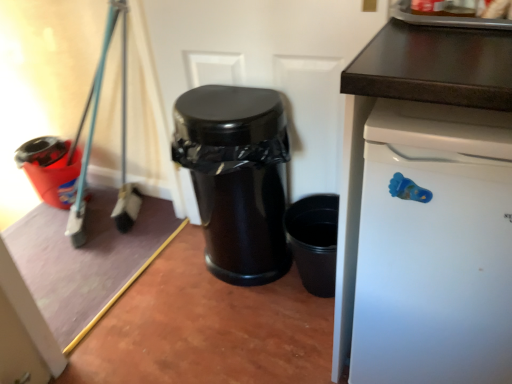
Question: From a real-world perspective, is glossy black trash can at center, which is the 1th waste container in front-to-back order, physically below white matte dishwasher at right?

Choices:
 (A) yes
 (B) no

Answer: (A)

Question: From the image's perspective, is glossy black trash can at center, which is the second waste container in back-to-front order, on white matte dishwasher at right?

Choices:
 (A) no
 (B) yes

Answer: (B)

Question: Is glossy black trash can at center, which is the 1th waste container in front-to-back order, facing towards white matte dishwasher at right?

Choices:
 (A) yes
 (B) no

Answer: (B)

Question: Is glossy black trash can at center, positioned as the first waste container in right-to-left order, to the right of white matte dishwasher at right from the viewer's perspective?

Choices:
 (A) no
 (B) yes

Answer: (A)

Question: Is white matte dishwasher at right a part of glossy black trash can at center, which is the 1th waste container in front-to-back order?

Choices:
 (A) no
 (B) yes

Answer: (A)

Question: Based on their sizes in the image, would you say white matte dishwasher at right is bigger or smaller than matte plastic bucket at left, placed as the 2th waste container when sorted from front to back?

Choices:
 (A) big
 (B) small

Answer: (A)

Question: From the image's perspective, is white matte dishwasher at right positioned above or below matte plastic bucket at left, the first waste container when ordered from back to front?

Choices:
 (A) above
 (B) below

Answer: (B)

Question: Choose the correct answer: Is white matte dishwasher at right inside matte plastic bucket at left, which ranks as the 2th waste container in right-to-left order, or outside it?

Choices:
 (A) inside
 (B) outside

Answer: (B)

Question: In the image, is white matte dishwasher at right on the left side or the right side of matte plastic bucket at left, the first waste container when ordered from back to front?

Choices:
 (A) left
 (B) right

Answer: (B)

Question: Considering the positions of point (217, 215) and point (431, 286), is point (217, 215) closer or farther from the camera than point (431, 286)?

Choices:
 (A) farther
 (B) closer

Answer: (A)

Question: Considering the positions of glossy black trash can at center, the second waste container when ordered from left to right, and white matte dishwasher at right in the image, is glossy black trash can at center, the second waste container when ordered from left to right, bigger or smaller than white matte dishwasher at right?

Choices:
 (A) big
 (B) small

Answer: (B)

Question: Is glossy black trash can at center, which is the 1th waste container in front-to-back order, taller or shorter than white matte dishwasher at right?

Choices:
 (A) short
 (B) tall

Answer: (A)

Question: Is glossy black trash can at center, positioned as the first waste container in right-to-left order, to the left or to the right of white matte dishwasher at right in the image?

Choices:
 (A) left
 (B) right

Answer: (A)

Question: In terms of height, does matte plastic bucket at left, the first waste container when ordered from back to front, look taller or shorter compared to glossy black trash can at center, which is the second waste container in back-to-front order?

Choices:
 (A) tall
 (B) short

Answer: (B)

Question: Looking at their shapes, would you say matte plastic bucket at left, placed as the 2th waste container when sorted from front to back, is wider or thinner than glossy black trash can at center, the second waste container when ordered from left to right?

Choices:
 (A) thin
 (B) wide

Answer: (B)